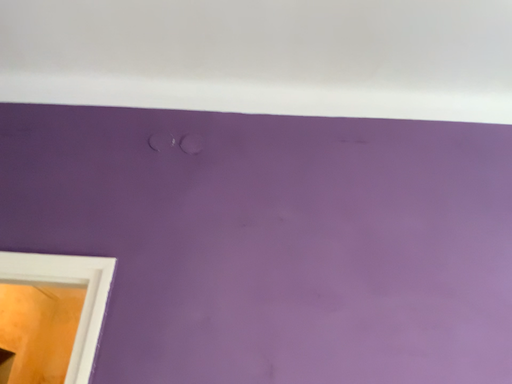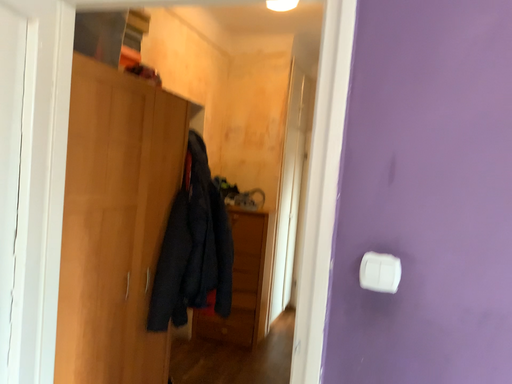
Question: Which way did the camera rotate in the video?

Choices:
 (A) rotated upward
 (B) rotated downward

Answer: (B)